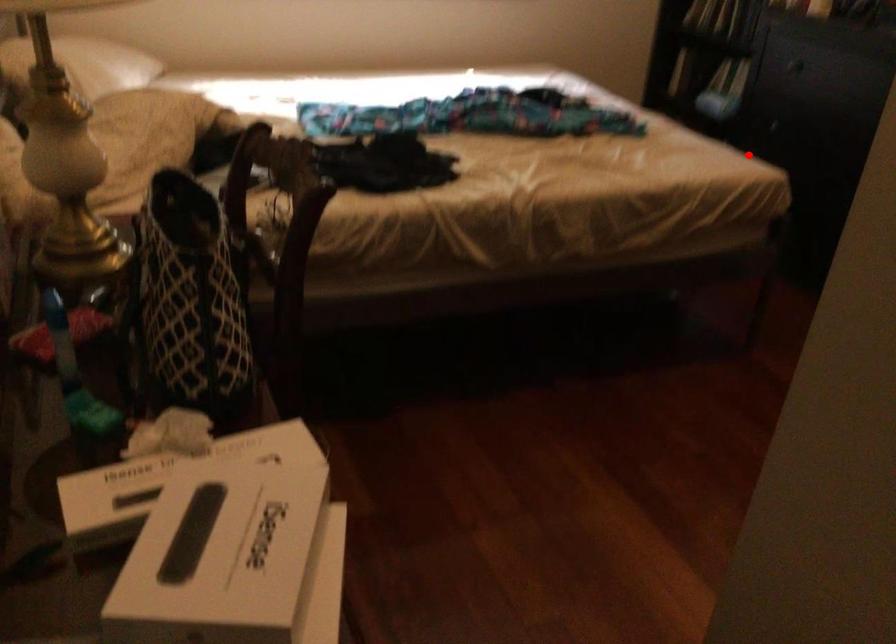
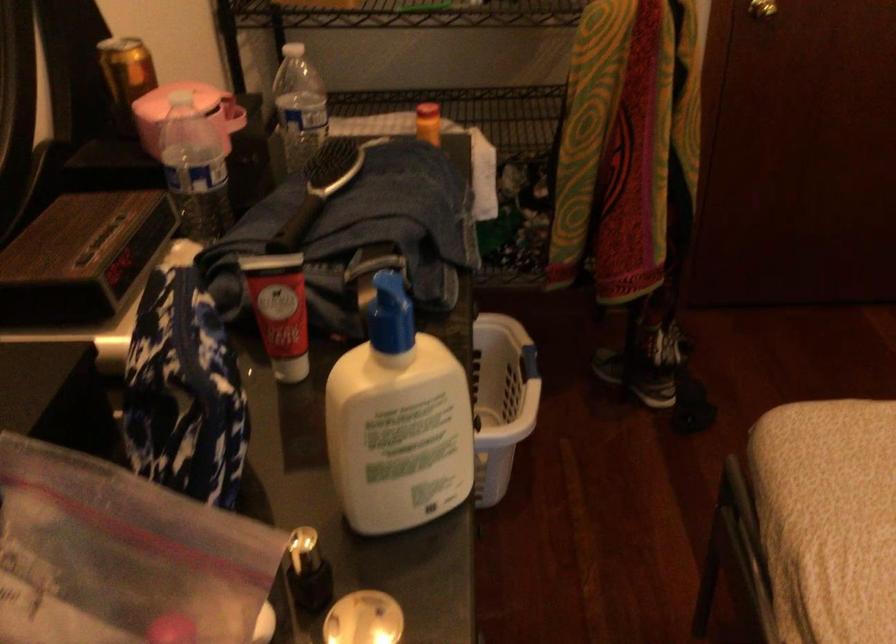
Question: A red point is marked in image1. In image2, is the corresponding 3D point closer to the camera or farther? Reply with the corresponding letter.

Choices:
 (A) The corresponding 3D point is closer.
 (B) The corresponding 3D point is farther.

Answer: (A)